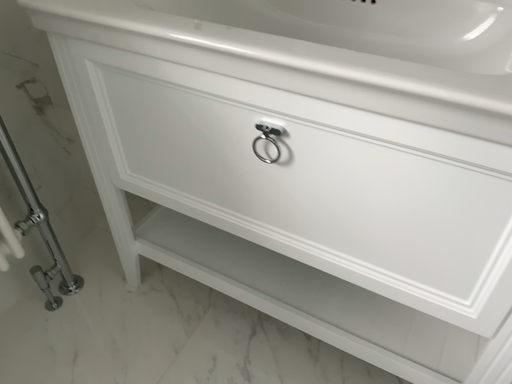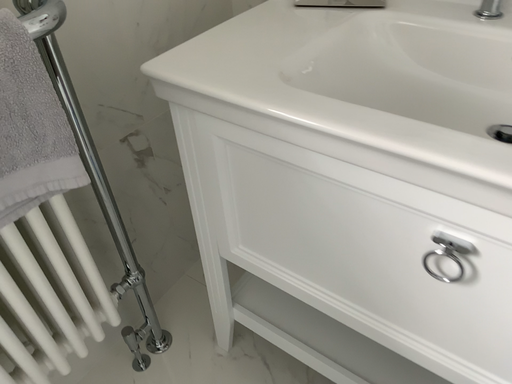
Question: How did the camera likely rotate when shooting the video?

Choices:
 (A) rotated right
 (B) rotated left

Answer: (B)